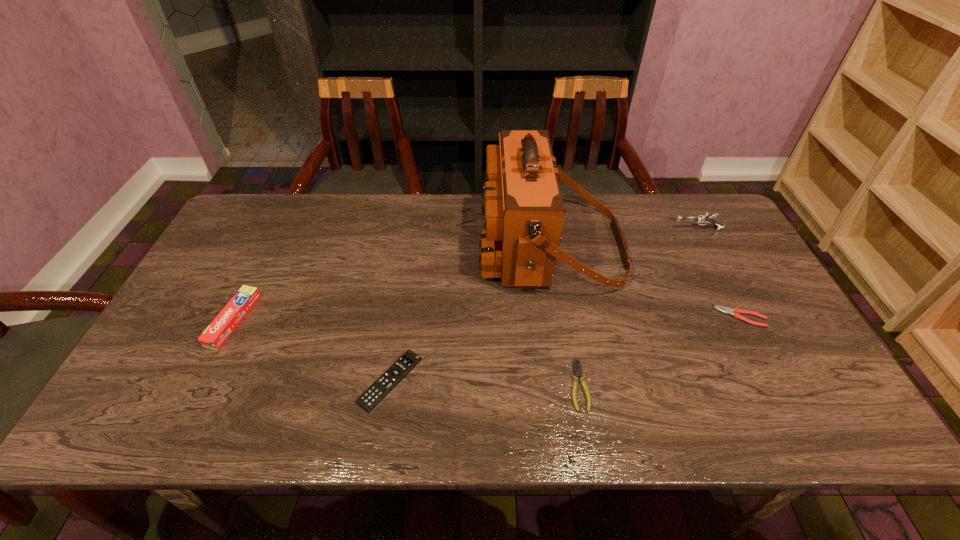
Identify the location of vacant space located aimed along the barrel of the second tallest object. This screenshot has height=540, width=960. (602, 229).

Image resolution: width=960 pixels, height=540 pixels. In order to click on vacant space situated aimed along the barrel of the second tallest object in this screenshot , I will do `click(573, 229)`.

The width and height of the screenshot is (960, 540). I want to click on free space located aimed along the barrel of the second tallest object, so coord(605,229).

At what (x,y) coordinates should I click in order to perform the action: click on vacant space located on the front of the leftmost object. Please return your answer as a coordinate pair (x, y). The width and height of the screenshot is (960, 540). Looking at the image, I should click on (185, 419).

Identify the location of vacant space located 0.230m on the back of the farther pliers. (706, 250).

In order to click on vacant point located on the left of the remote control in this screenshot , I will do `click(190, 380)`.

The image size is (960, 540). What are the coordinates of `vacant space positioned 0.290m on the back of the nearer pliers` in the screenshot? It's located at (560, 275).

At what (x,y) coordinates should I click in order to perform the action: click on satchel located at the far edge. Please return your answer as a coordinate pair (x, y). The height and width of the screenshot is (540, 960). Looking at the image, I should click on (522, 202).

Where is `gun that is at the far edge`? gun that is at the far edge is located at coordinates (704, 219).

Locate an element on the screen. The image size is (960, 540). remote control that is positioned at the near edge is located at coordinates (390, 378).